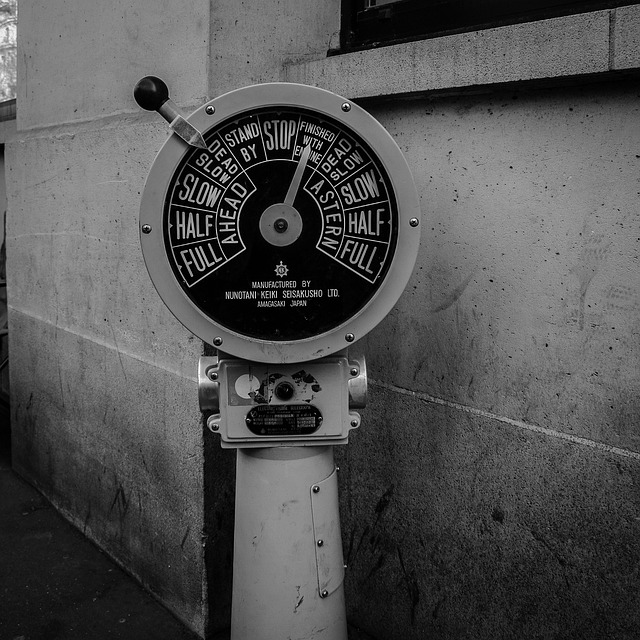
Identify the location of handle. (157, 97).